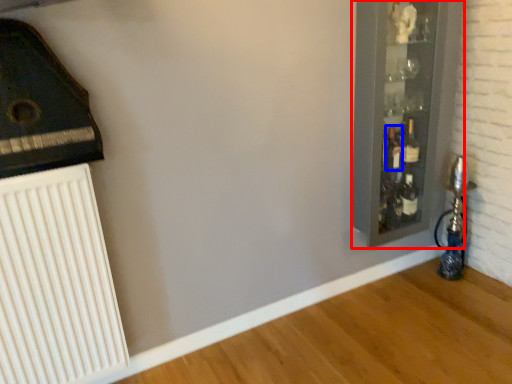
Question: Which of the following is the farthest to the observer, glass door (highlighted by a red box) or bottle (highlighted by a blue box)?

Choices:
 (A) glass door
 (B) bottle

Answer: (B)